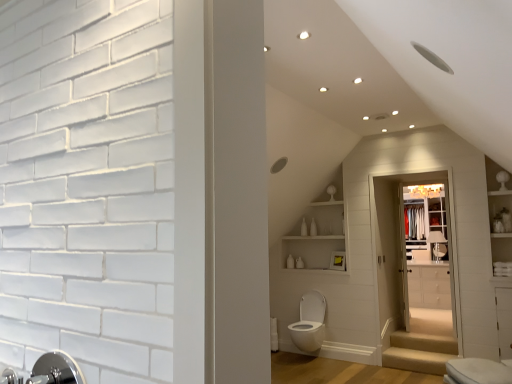
Question: Is beige carpeted stairs at lower center, which is the second stairwell in bottom-to-top order, taller than white glossy shelves at upper center?

Choices:
 (A) no
 (B) yes

Answer: (A)

Question: Can we say beige carpeted stairs at lower center, which is the second stairwell in bottom-to-top order, lies outside white glossy shelves at upper center?

Choices:
 (A) yes
 (B) no

Answer: (A)

Question: From the image's perspective, is beige carpeted stairs at lower center, which is the second stairwell in bottom-to-top order, located above white glossy shelves at upper center?

Choices:
 (A) no
 (B) yes

Answer: (A)

Question: Is the position of beige carpeted stairs at lower center, which is the second stairwell in bottom-to-top order, more distant than that of white glossy shelves at upper center?

Choices:
 (A) no
 (B) yes

Answer: (A)

Question: Are beige carpeted stairs at lower center, which is the second stairwell in bottom-to-top order, and white glossy shelves at upper center far apart?

Choices:
 (A) yes
 (B) no

Answer: (A)

Question: Considering the relative positions of beige carpeted stairs at lower center, which appears as the 1th stairwell when viewed from the top, and white glossy shelves at upper center in the image provided, is beige carpeted stairs at lower center, which appears as the 1th stairwell when viewed from the top, in front of white glossy shelves at upper center?

Choices:
 (A) yes
 (B) no

Answer: (A)

Question: Can you confirm if silver metallic faucet at lower left is smaller than white glossy cabinet at center?

Choices:
 (A) yes
 (B) no

Answer: (A)

Question: Is silver metallic faucet at lower left taller than white glossy cabinet at center?

Choices:
 (A) no
 (B) yes

Answer: (A)

Question: Does silver metallic faucet at lower left have a lesser height compared to white glossy cabinet at center?

Choices:
 (A) yes
 (B) no

Answer: (A)

Question: Is silver metallic faucet at lower left surrounding white glossy cabinet at center?

Choices:
 (A) no
 (B) yes

Answer: (A)

Question: Is silver metallic faucet at lower left positioned before white glossy cabinet at center?

Choices:
 (A) yes
 (B) no

Answer: (B)

Question: Is silver metallic faucet at lower left completely or partially outside of white glossy cabinet at center?

Choices:
 (A) no
 (B) yes

Answer: (B)

Question: Is white glossy medicine cabinet at upper center to the left of white glossy shelves at upper center from the viewer's perspective?

Choices:
 (A) no
 (B) yes

Answer: (A)